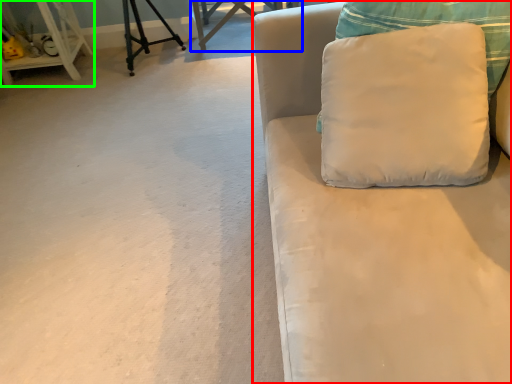
Question: Based on their relative distances, which object is nearer to studio couch (highlighted by a red box)? Choose from table (highlighted by a blue box) and furniture (highlighted by a green box).

Choices:
 (A) table
 (B) furniture

Answer: (A)